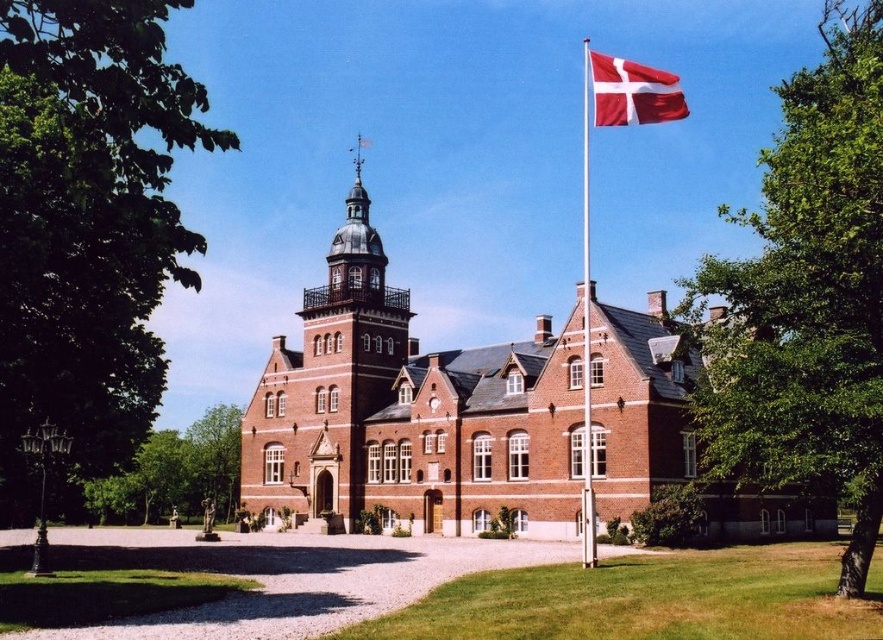
You are a visitor approaching the historic building and want to take a photo of the brick tower at center and the white metallic flag pole at upper right. From your current position, which object appears higher in the frame?

The white metallic flag pole at upper right appears higher in the frame than the brick tower at center because it is positioned above it.

You are a visitor approaching the building and want to take a photo of the brick tower at center and the white metallic flag pole at upper right. Which object will appear larger in your camera viewfinder?

The white metallic flag pole at upper right will appear larger in the camera viewfinder because it is taller than the brick tower at center.